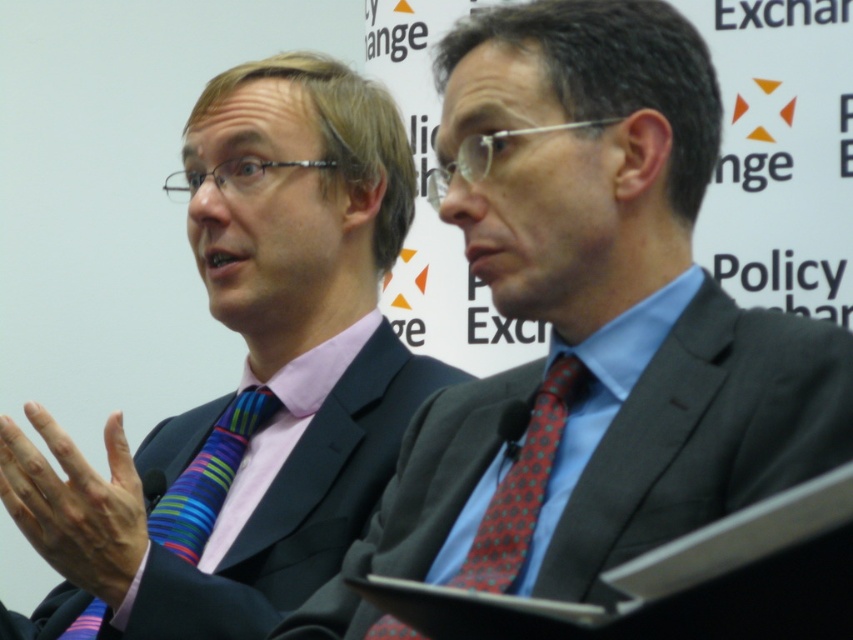
You are standing in front of the two individuals in the professional setting. You need to place a name tag on the point that is closer to you. Which point should you choose between point (660, 339) and point (248, 438)?

Point (660, 339) is in front of point (248, 438), so you should place the name tag on point (660, 339) since it is closer to you.

You are a photographer adjusting your camera settings to focus on two specific points in the image. The points are labeled as point (497, 77) and point (289, 497). Which point should you focus on first to ensure the closest object is sharp?

Point (497, 77) is closer to the camera than point (289, 497), so you should focus on point (497, 77) first to ensure the closest object is sharp.